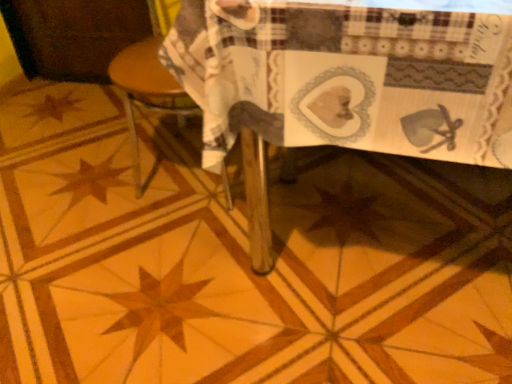
Find the location of a particular element. This screenshot has width=512, height=384. vacant space to the left of wooden table at center is located at coordinates (106, 244).